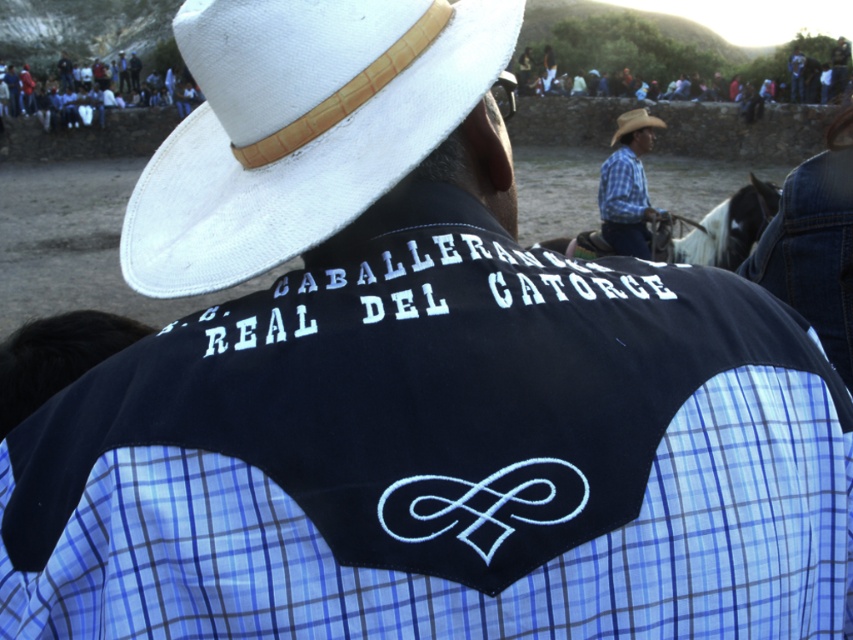
Between white straw hat at upper center and white glossy horse at upper center, which one has more height?

Standing taller between the two is white straw hat at upper center.

Does white straw hat at upper center lie behind white glossy horse at upper center?

No.

Is point (322, 44) behind point (664, 244)?

No, (322, 44) is in front of (664, 244).

Locate an element on the screen. This screenshot has width=853, height=640. white straw hat at upper center is located at coordinates (300, 125).

Between white straw hat at upper center and tan straw cowboy hat at upper center, which one appears on the left side from the viewer's perspective?

From the viewer's perspective, white straw hat at upper center appears more on the left side.

Can you confirm if white straw hat at upper center is taller than tan straw cowboy hat at upper center?

In fact, white straw hat at upper center may be shorter than tan straw cowboy hat at upper center.

Describe the element at coordinates (300, 125) in the screenshot. This screenshot has width=853, height=640. I see `white straw hat at upper center` at that location.

Image resolution: width=853 pixels, height=640 pixels. What are the coordinates of `white straw hat at upper center` in the screenshot? It's located at (300, 125).

Does white straw hat at upper center have a lesser height compared to blue jeans at upper center?

Yes.

Is white straw hat at upper center above blue jeans at upper center?

No, white straw hat at upper center is not above blue jeans at upper center.

Which is in front, point (310, 61) or point (132, 102)?

Point (310, 61) is in front.

The image size is (853, 640). What are the coordinates of `white straw hat at upper center` in the screenshot? It's located at (300, 125).